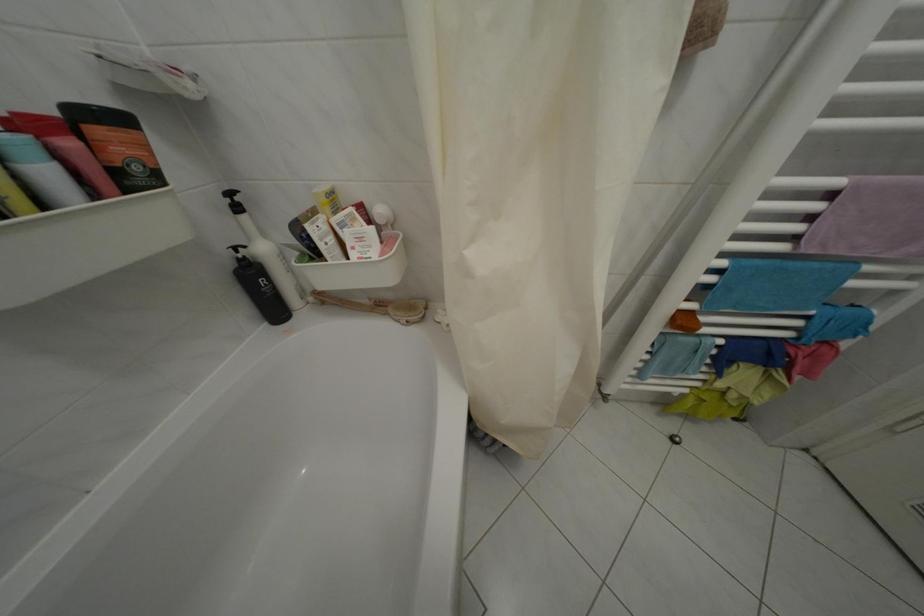
Locate an element on the screen. This screenshot has height=616, width=924. black pump head is located at coordinates (238, 254).